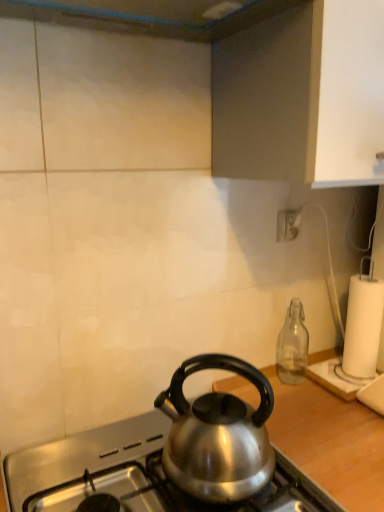
Question: From the image's perspective, is satin silver kettle at center beneath white paper at right?

Choices:
 (A) no
 (B) yes

Answer: (B)

Question: Is satin silver kettle at center oriented towards white paper at right?

Choices:
 (A) yes
 (B) no

Answer: (B)

Question: Is satin silver kettle at center turned away from white paper at right?

Choices:
 (A) yes
 (B) no

Answer: (B)

Question: From the image's perspective, is satin silver kettle at center over white paper at right?

Choices:
 (A) yes
 (B) no

Answer: (B)

Question: Could white paper at right be considered to be inside satin silver kettle at center?

Choices:
 (A) yes
 (B) no

Answer: (B)

Question: Would you say satin silver kettle at center is to the left or to the right of shiny metallic kettle at center in the picture?

Choices:
 (A) right
 (B) left

Answer: (B)

Question: From a real-world perspective, is satin silver kettle at center positioned above or below shiny metallic kettle at center?

Choices:
 (A) above
 (B) below

Answer: (A)

Question: Looking at the image, does satin silver kettle at center seem bigger or smaller compared to shiny metallic kettle at center?

Choices:
 (A) small
 (B) big

Answer: (A)

Question: Does point (253, 482) appear closer or farther from the camera than point (299, 456)?

Choices:
 (A) farther
 (B) closer

Answer: (B)

Question: From a real-world perspective, is white paper at right positioned above or below white plastic power outlet at upper right?

Choices:
 (A) below
 (B) above

Answer: (A)

Question: From the image's perspective, relative to white plastic power outlet at upper right, is white paper at right above or below?

Choices:
 (A) above
 (B) below

Answer: (B)

Question: Considering the positions of white paper at right and white plastic power outlet at upper right in the image, is white paper at right wider or thinner than white plastic power outlet at upper right?

Choices:
 (A) thin
 (B) wide

Answer: (B)

Question: Does point (377, 315) appear closer or farther from the camera than point (294, 219)?

Choices:
 (A) farther
 (B) closer

Answer: (B)

Question: From the image's perspective, is transparent glass bottle at right positioned above or below shiny metallic kettle at center?

Choices:
 (A) above
 (B) below

Answer: (A)

Question: Is point (289, 329) closer or farther from the camera than point (302, 433)?

Choices:
 (A) closer
 (B) farther

Answer: (B)